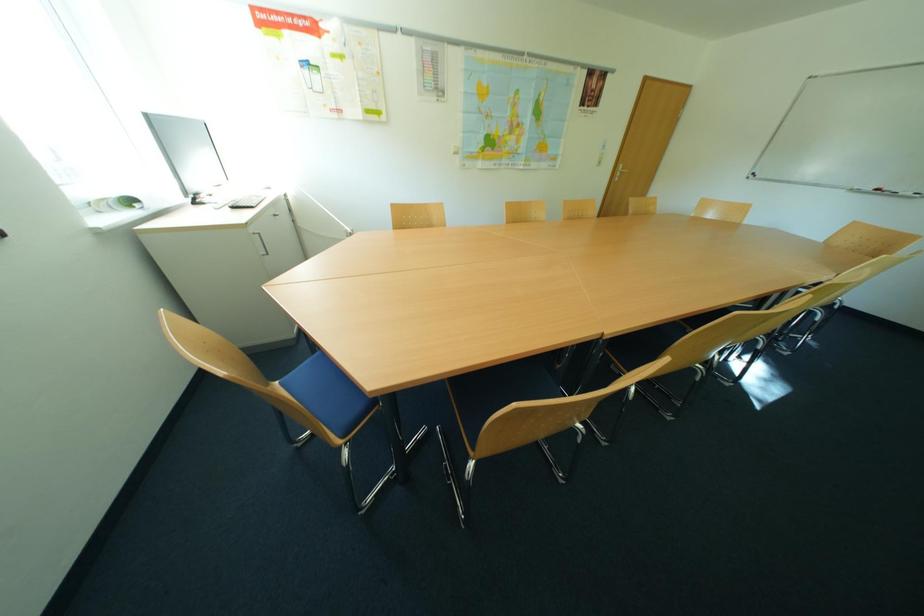
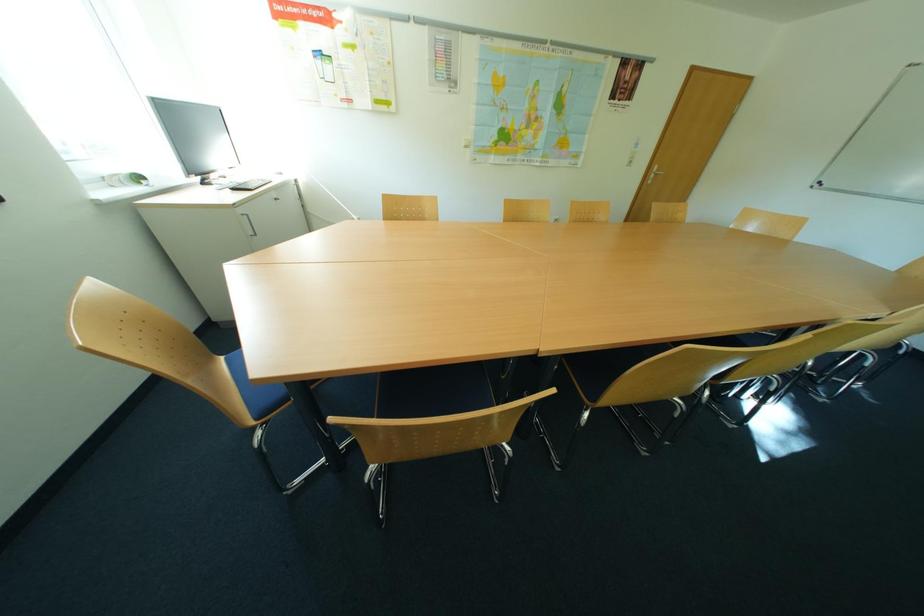
Question: The camera is either moving clockwise (left) or counter-clockwise (right) around the object. The first image is from the beginning of the video and the second image is from the end. Is the camera moving left or right when shooting the video?

Choices:
 (A) Left
 (B) Right

Answer: (B)